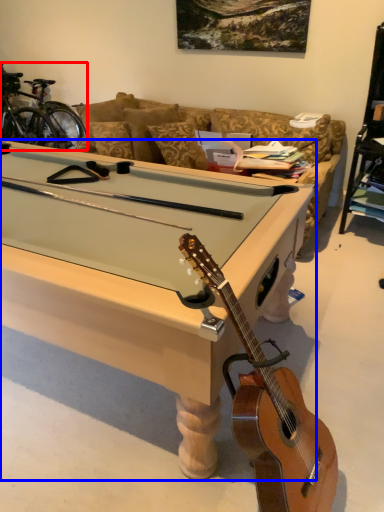
Question: Which object appears farthest to the camera in this image, bicycle (highlighted by a red box) or desk (highlighted by a blue box)?

Choices:
 (A) bicycle
 (B) desk

Answer: (A)